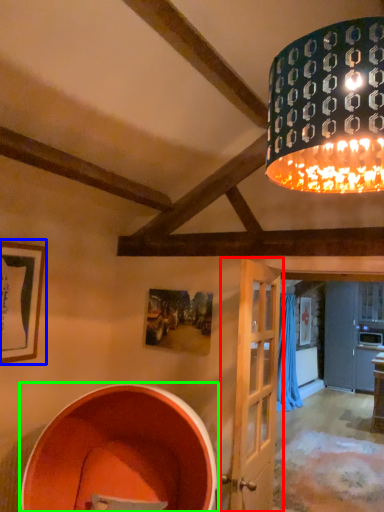
Question: Which object is the farthest from door (highlighted by a red box)? Choose among these: picture frame (highlighted by a blue box) or barrel (highlighted by a green box).

Choices:
 (A) picture frame
 (B) barrel

Answer: (A)